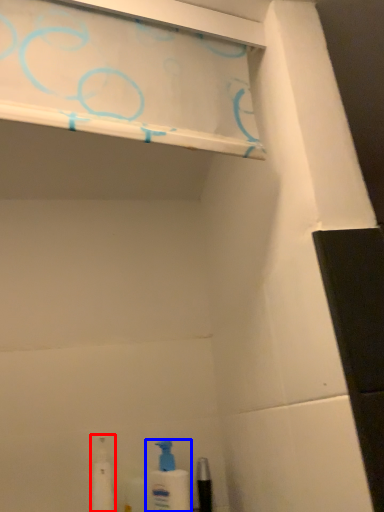
Question: Which object appears closest to the camera in this image, toiletry (highlighted by a red box) or cleaning product (highlighted by a blue box)?

Choices:
 (A) toiletry
 (B) cleaning product

Answer: (A)